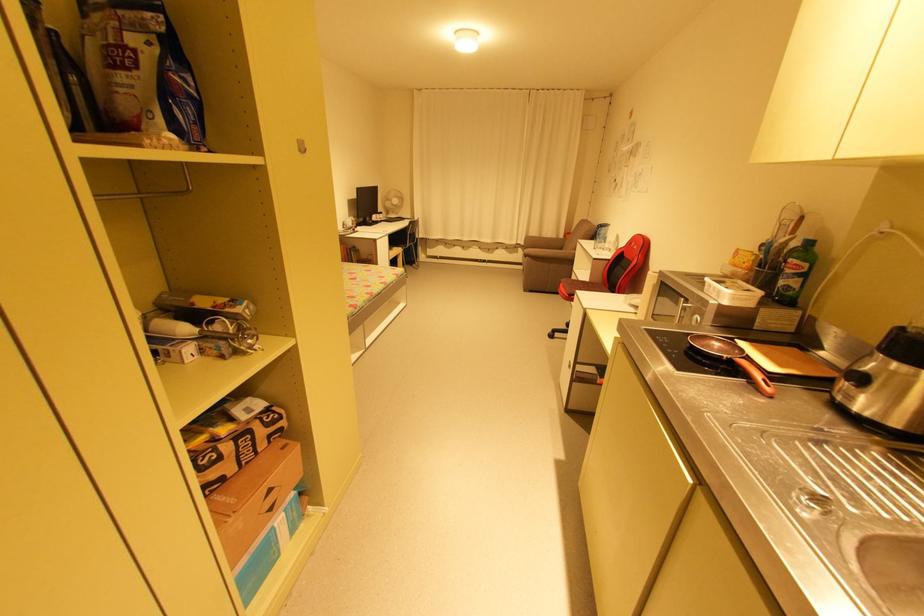
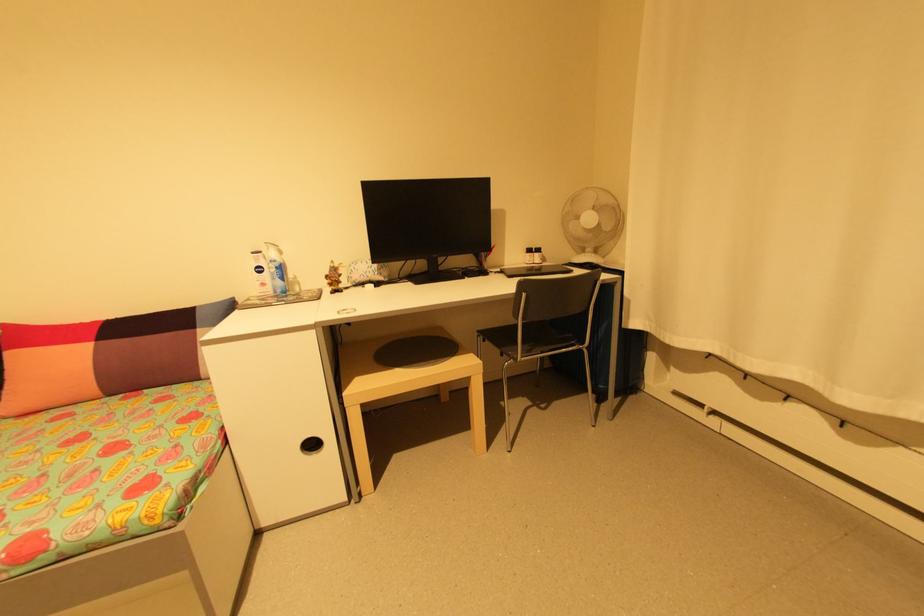
In the second image, find the point that corresponds to pixel 397 214 in the first image.

(600, 252)